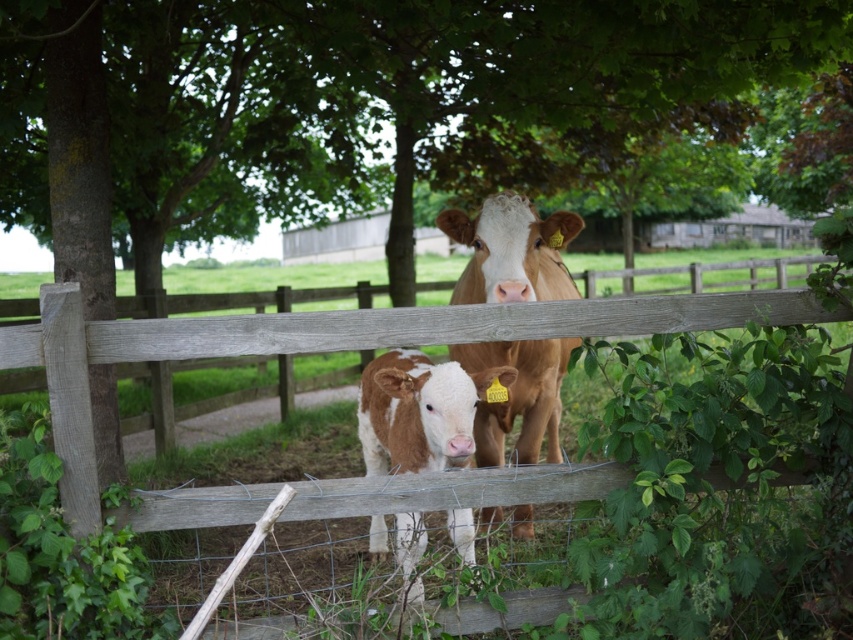
Question: Which of the following is the farthest from the observer?

Choices:
 (A) brown smooth cow at center
 (B) weathered wood fence at center
 (C) brown speckled calf at center

Answer: (A)

Question: Does brown smooth cow at center have a smaller size compared to brown speckled calf at center?

Choices:
 (A) yes
 (B) no

Answer: (B)

Question: Considering the real-world distances, which object is closest to the brown smooth cow at center?

Choices:
 (A) weathered wood fence at center
 (B) brown speckled calf at center

Answer: (B)

Question: Does weathered wood fence at center appear on the right side of brown smooth cow at center?

Choices:
 (A) no
 (B) yes

Answer: (A)

Question: Does weathered wood fence at center appear on the left side of brown smooth cow at center?

Choices:
 (A) yes
 (B) no

Answer: (A)

Question: Which point appears farthest from the camera in this image?

Choices:
 (A) (430, 451)
 (B) (527, 244)
 (C) (152, 340)

Answer: (B)